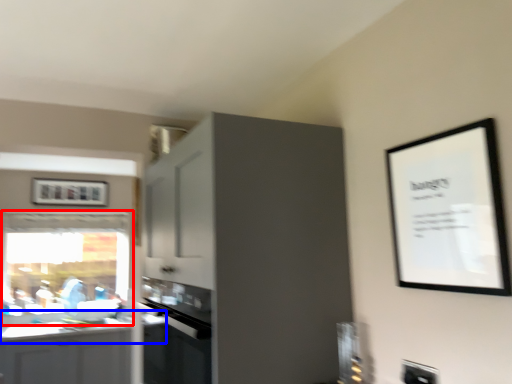
Question: Which point is further to the camera, window (highlighted by a red box) or countertop (highlighted by a blue box)?

Choices:
 (A) window
 (B) countertop

Answer: (A)